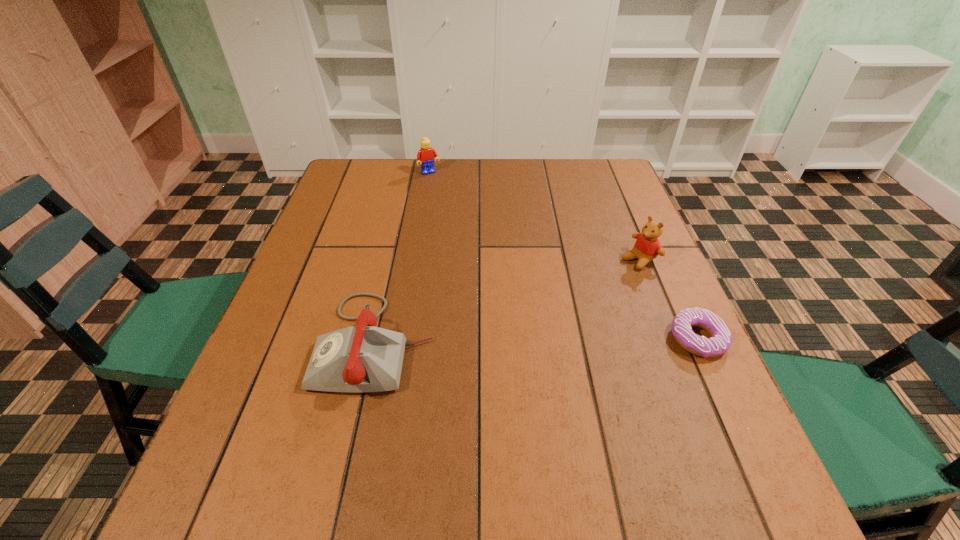
Locate an element on the screen. This screenshot has height=540, width=960. vacant space located 0.170m on the front-facing side of the second farthest object is located at coordinates (577, 295).

What are the coordinates of `free space located 0.150m on the front-facing side of the second farthest object` in the screenshot? It's located at (584, 291).

Identify the location of blank area located on the front-facing side of the second farthest object. (555, 307).

Locate an element on the screen. The height and width of the screenshot is (540, 960). object at the far edge is located at coordinates (426, 154).

At what (x,y) coordinates should I click in order to perform the action: click on object located at the left edge. Please return your answer as a coordinate pair (x, y). This screenshot has height=540, width=960. Looking at the image, I should click on (364, 358).

The height and width of the screenshot is (540, 960). I want to click on doughnut that is at the right edge, so click(721, 338).

Where is `teddy bear at the right edge`? The height and width of the screenshot is (540, 960). teddy bear at the right edge is located at coordinates (647, 247).

Find the location of a particular element. The height and width of the screenshot is (540, 960). free space at the far edge is located at coordinates (521, 178).

I want to click on free space at the near edge, so click(366, 414).

Locate an element on the screen. The image size is (960, 540). free space at the left edge of the desktop is located at coordinates (320, 266).